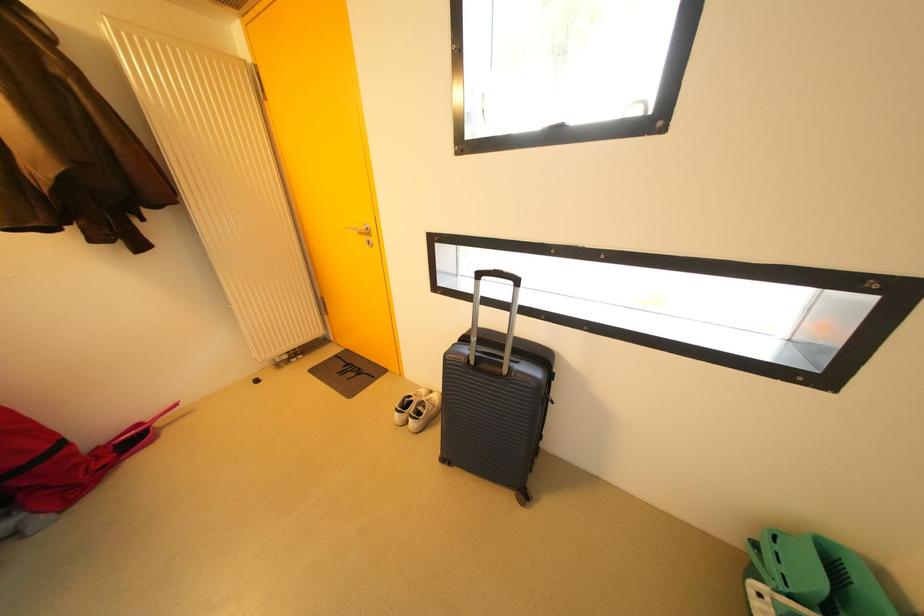
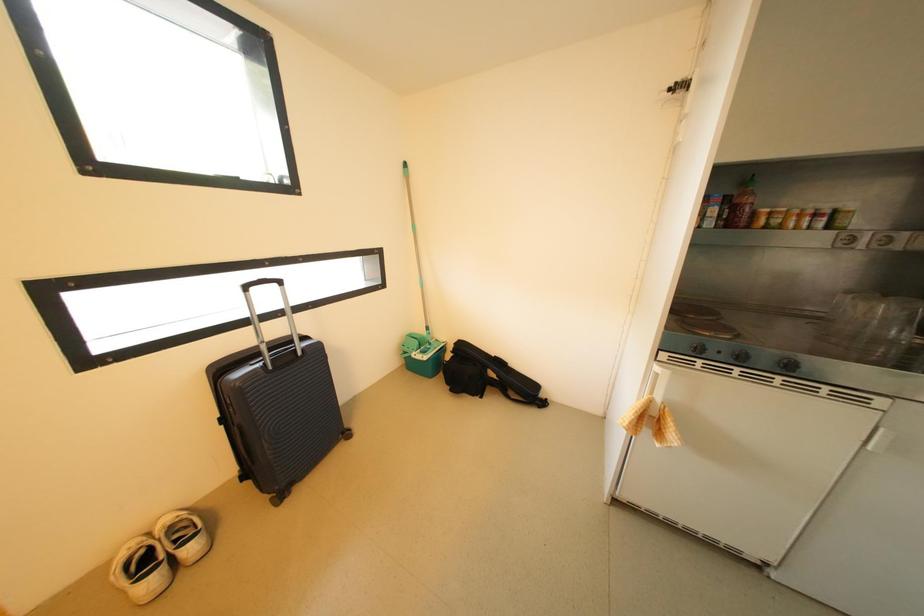
How did the camera likely rotate?

The camera's rotation is toward right-down.